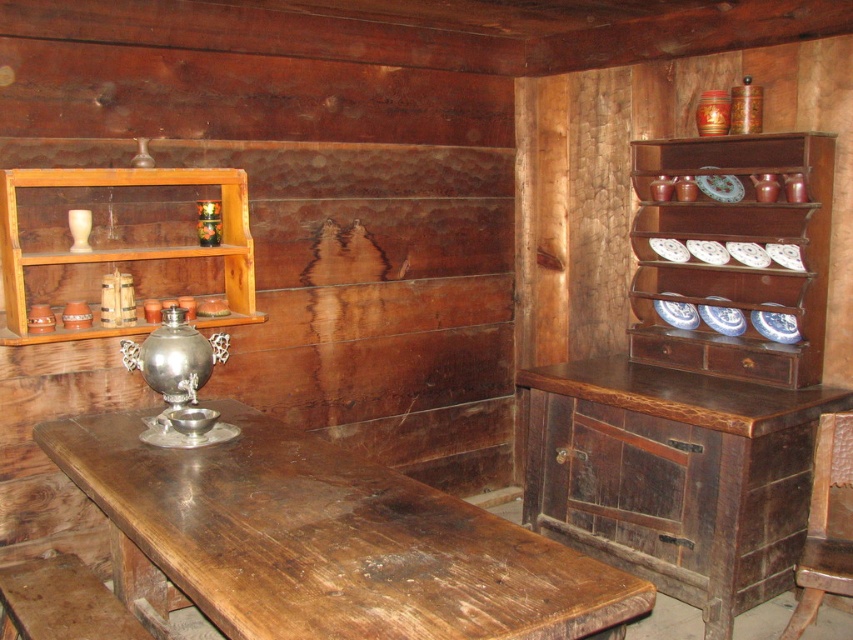
Can you confirm if wooden table at center is positioned above brown wooden chair at right?

Correct, wooden table at center is located above brown wooden chair at right.

At what (x,y) coordinates should I click in order to perform the action: click on wooden table at center. Please return your answer as a coordinate pair (x, y). The image size is (853, 640). Looking at the image, I should click on (323, 540).

Does wooden table at center have a greater width compared to dark brown wooden cabinet at right?

Indeed, wooden table at center has a greater width compared to dark brown wooden cabinet at right.

Measure the distance between wooden table at center and camera.

wooden table at center and camera are 1.31 meters apart.

Image resolution: width=853 pixels, height=640 pixels. I want to click on wooden table at center, so click(323, 540).

Is dark brown wooden cabinet at right bigger than wooden shelf at upper left?

Yes.

Is dark brown wooden cabinet at right below wooden shelf at upper left?

Correct, dark brown wooden cabinet at right is located below wooden shelf at upper left.

Is point (682, 586) farther from viewer compared to point (0, 253)?

No, (682, 586) is in front of (0, 253).

This screenshot has height=640, width=853. What are the coordinates of `dark brown wooden cabinet at right` in the screenshot? It's located at (672, 476).